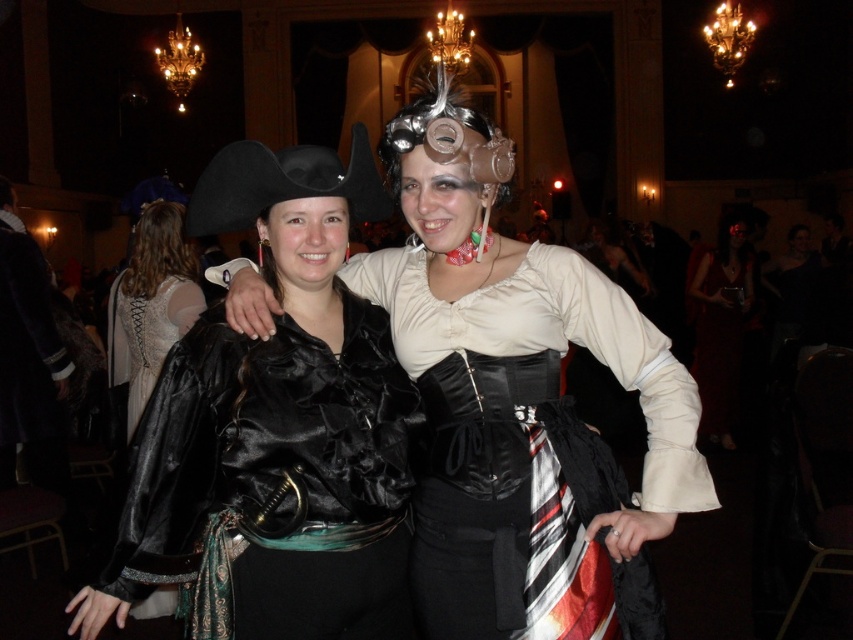
Does shiny black pirate costume at center appear on the right side of satin black vest at center?

Correct, you'll find shiny black pirate costume at center to the right of satin black vest at center.

Between point (430, 516) and point (252, 628), which one is positioned behind?

The point (430, 516) is behind.

The height and width of the screenshot is (640, 853). Identify the location of shiny black pirate costume at center. (520, 404).

You are a GUI agent. You are given a task and a screenshot of the screen. Output one action in this format:
    pyautogui.click(x=<x>, y=<y>)
    Task: Click on the shiny black pirate costume at center
    The image size is (853, 640).
    Given the screenshot: What is the action you would take?
    pyautogui.click(x=520, y=404)

Does satin black vest at center have a greater height compared to matte black dress at center?

Indeed, satin black vest at center has a greater height compared to matte black dress at center.

Does point (149, 492) lie behind point (128, 392)?

That is False.

Find the location of a particular element. satin black vest at center is located at coordinates (274, 483).

Does shiny black pirate costume at center have a lesser height compared to matte black dress at center?

No, shiny black pirate costume at center is not shorter than matte black dress at center.

Which is above, shiny black pirate costume at center or matte black dress at center?

Positioned higher is matte black dress at center.

Which is in front, point (463, 628) or point (163, 289)?

Positioned in front is point (463, 628).

Where is `shiny black pirate costume at center`? The height and width of the screenshot is (640, 853). shiny black pirate costume at center is located at coordinates (520, 404).